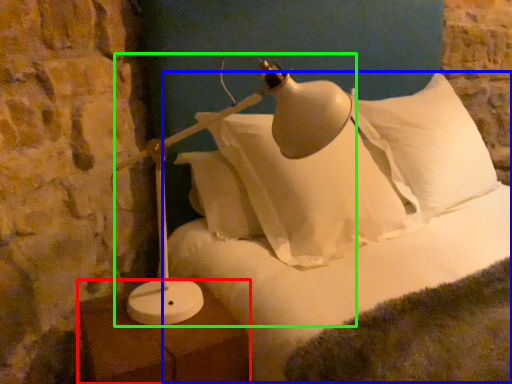
Question: Estimate the real-world distances between objects in this image. Which object is farther from furniture (highlighted by a red box), bed (highlighted by a blue box) or lamp (highlighted by a green box)?

Choices:
 (A) bed
 (B) lamp

Answer: (A)